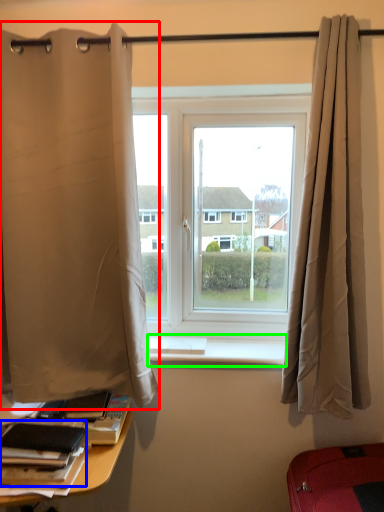
Question: Which object is the farthest from curtain (highlighted by a red box)? Choose among these: book (highlighted by a blue box) or window sill (highlighted by a green box).

Choices:
 (A) book
 (B) window sill

Answer: (A)